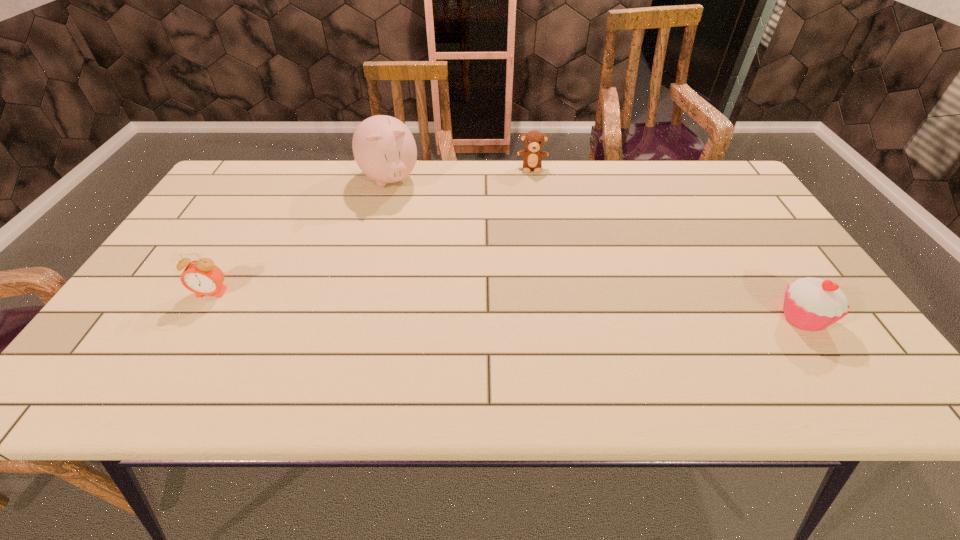
Locate an element on the screen. This screenshot has height=540, width=960. unoccupied area between the tallest object and the rightmost object is located at coordinates pyautogui.click(x=595, y=249).

You are a GUI agent. You are given a task and a screenshot of the screen. Output one action in this format:
    pyautogui.click(x=<x>, y=<y>)
    Task: Click on the blank region between the alarm clock and the piggy bank
    The height and width of the screenshot is (540, 960).
    Given the screenshot: What is the action you would take?
    pyautogui.click(x=300, y=237)

I want to click on empty location between the third object from right to left and the alarm clock, so click(300, 237).

This screenshot has height=540, width=960. In order to click on object that is the third closest to the third object from right to left in this screenshot , I will do `click(812, 304)`.

Image resolution: width=960 pixels, height=540 pixels. In order to click on object that is the third nearest to the third object from left to right in this screenshot , I will do `click(202, 277)`.

This screenshot has height=540, width=960. What are the coordinates of `vacant area in the image that satisfies the following two spatial constraints: 1. on the face of the alarm clock; 2. on the right side of the cupcake` in the screenshot? It's located at (197, 318).